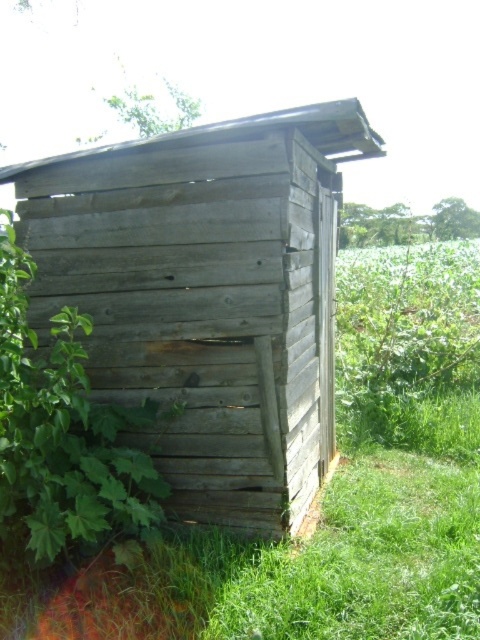
Which is behind, point (151, 365) or point (60, 312)?

Point (60, 312)

You are a GUI agent. You are given a task and a screenshot of the screen. Output one action in this format:
    pyautogui.click(x=<x>, y=<y>)
    Task: Click on the weathered wood hut at center
    
    Given the screenshot: What is the action you would take?
    pyautogui.click(x=206, y=296)